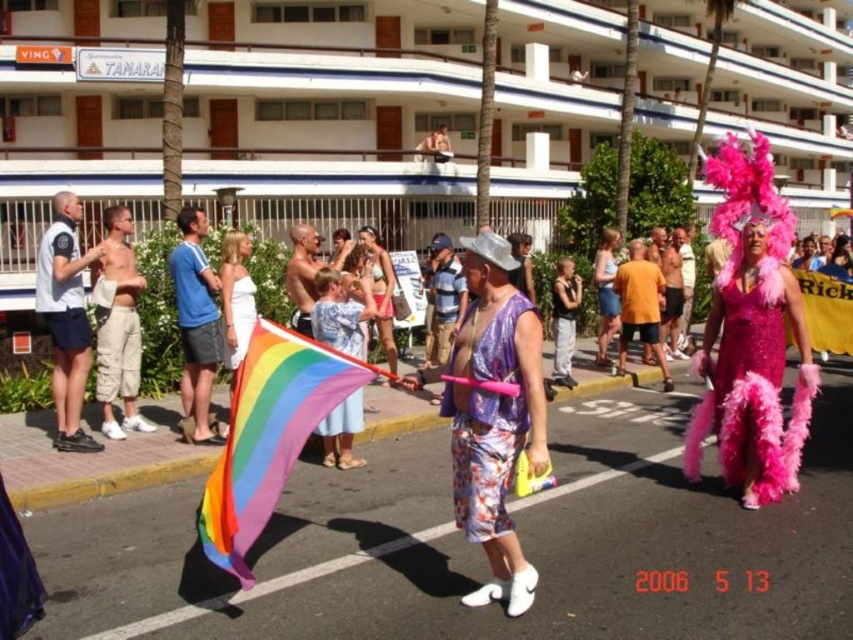
The width and height of the screenshot is (853, 640). Describe the element at coordinates (196, 324) in the screenshot. I see `blue denim shorts at center` at that location.

Between blue denim shorts at center and orange cotton t-shirt at center, which one is positioned lower?

Positioned lower is orange cotton t-shirt at center.

Is point (215, 301) in front of point (657, 273)?

That is True.

The image size is (853, 640). What are the coordinates of `blue denim shorts at center` in the screenshot? It's located at 196,324.

Is white fabric shorts at left closer to camera compared to blue denim shorts at center?

Yes, it is.

Does white fabric shorts at left have a greater height compared to blue denim shorts at center?

Indeed, white fabric shorts at left has a greater height compared to blue denim shorts at center.

What do you see at coordinates (67, 320) in the screenshot? This screenshot has height=640, width=853. I see `white fabric shorts at left` at bounding box center [67, 320].

Image resolution: width=853 pixels, height=640 pixels. What are the coordinates of `white fabric shorts at left` in the screenshot? It's located at (67, 320).

Can you confirm if white fabric shorts at left is positioned to the left of black fabric dress at center?

Indeed, white fabric shorts at left is positioned on the left side of black fabric dress at center.

Between white fabric shorts at left and black fabric dress at center, which one appears on the left side from the viewer's perspective?

Positioned to the left is white fabric shorts at left.

Locate an element on the screen. white fabric shorts at left is located at coordinates (67, 320).